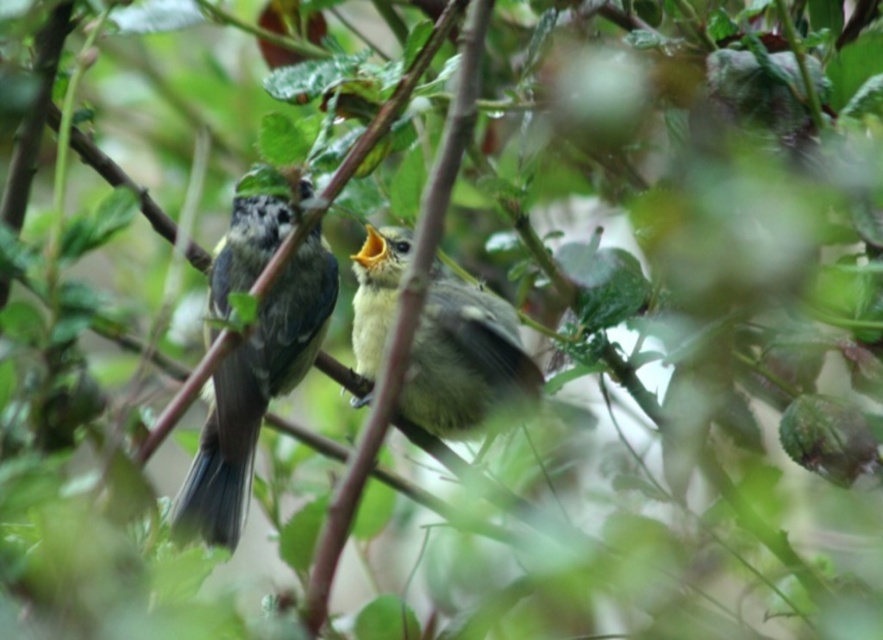
Is speckled gray bird at center thinner than yellow-green feathers at center?

Yes.

Is point (236, 525) closer to camera compared to point (396, 236)?

Yes, point (236, 525) is in front of point (396, 236).

Is point (285, 326) farther from viewer compared to point (474, 301)?

No, (285, 326) is closer to viewer.

You are a GUI agent. You are given a task and a screenshot of the screen. Output one action in this format:
    pyautogui.click(x=<x>, y=<y>)
    Task: Click on the speckled gray bird at center
    
    Given the screenshot: What is the action you would take?
    pyautogui.click(x=254, y=394)